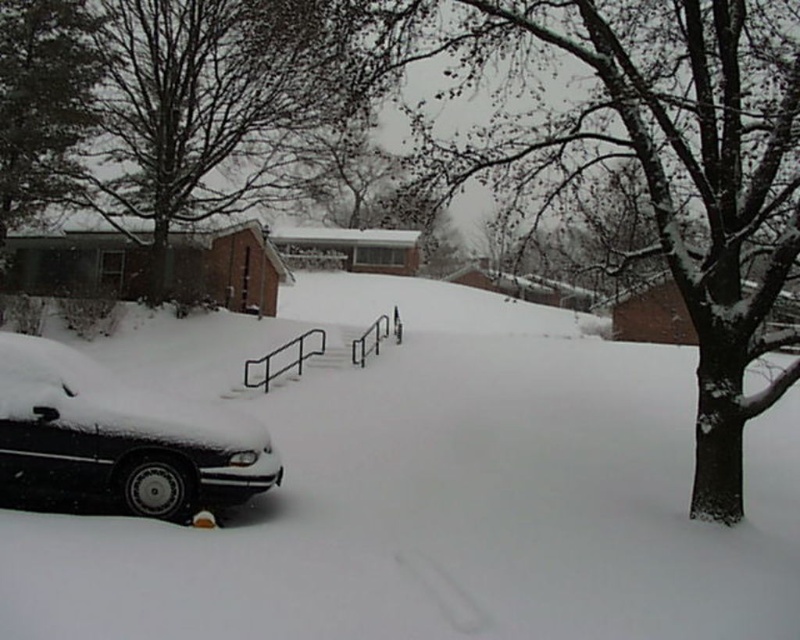
You are a delivery person trying to reach a house located behind the dark green leafy tree at upper left. The white matte snow at lower left is blocking your path. Can you walk through the snow to reach the house?

The white matte snow at lower left is in front of the dark green leafy tree at upper left, meaning the snow is between you and the tree. Since the snow is blocking your path, you would need to clear it or find an alternative route to reach the house behind the tree.